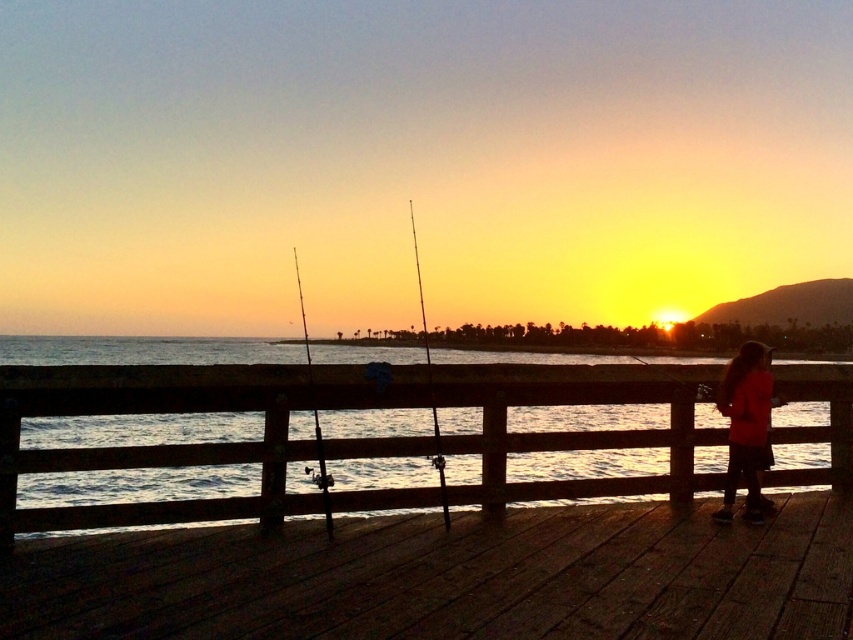
You are a maintenance worker on the dark wood dock at lower center and need to retrieve the silhouette rod at center. Can you reach it without moving from your current position?

The dark wood dock at lower center is 7.69 feet away from the silhouette rod at center. Since 7.69 feet is a considerable distance, you cannot reach the silhouette rod at center without moving from your current position.

You are standing on the wooden pier and want to move to the right side of the dark wood dock at lower center. Which direction should you walk relative to the silhouette rod at center?

You should walk to the right of the silhouette rod at center because the dark wood dock at lower center is located to the right of the silhouette rod at center.